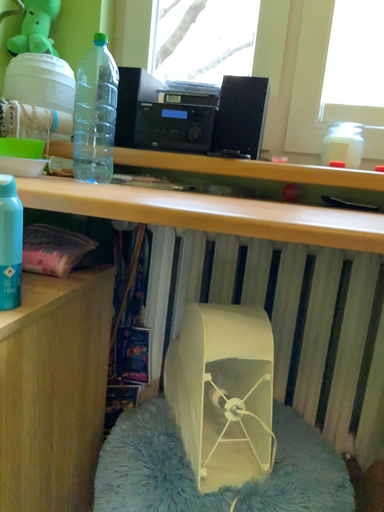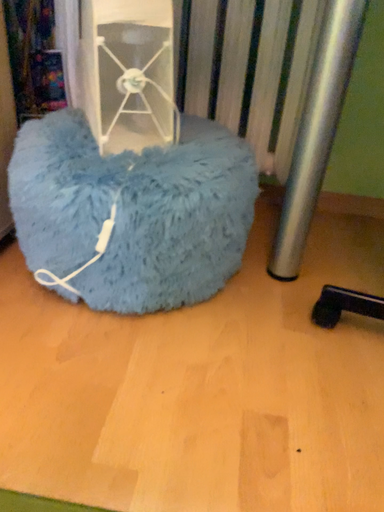
Question: How did the camera likely rotate when shooting the video?

Choices:
 (A) rotated upward
 (B) rotated downward

Answer: (B)